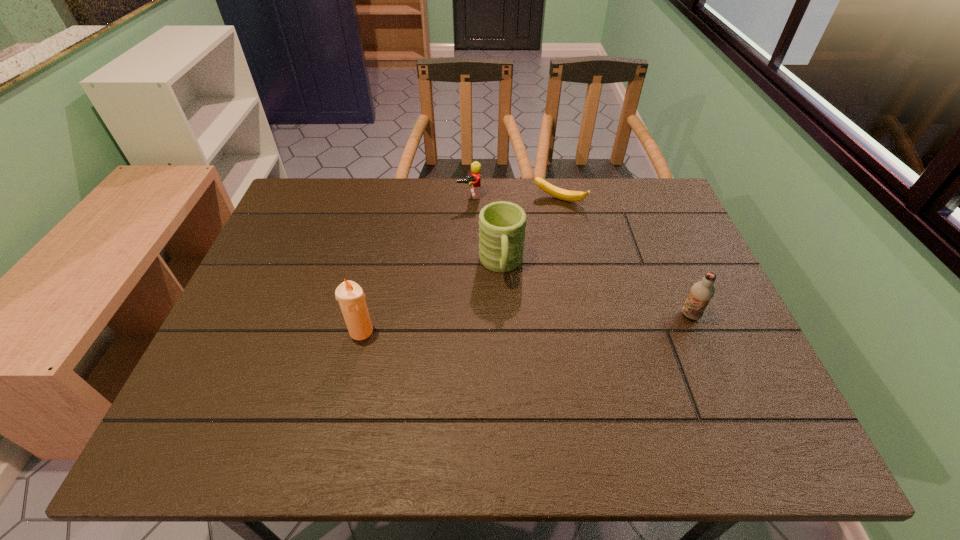
Where is `vacant space on the desktop that is between the leftmost object and the rightmost object and is positioned at the stem of the banana`? vacant space on the desktop that is between the leftmost object and the rightmost object and is positioned at the stem of the banana is located at coordinates (502, 324).

Locate an element on the screen. vacant space on the desktop that is between the leftmost object and the rightmost object and is positioned on the side of the third farthest object with the handle is located at coordinates (507, 324).

I want to click on free space on the desktop that is between the tallest object and the chocolate milk and is positioned in front of the Lego with the accessory visible, so click(506, 324).